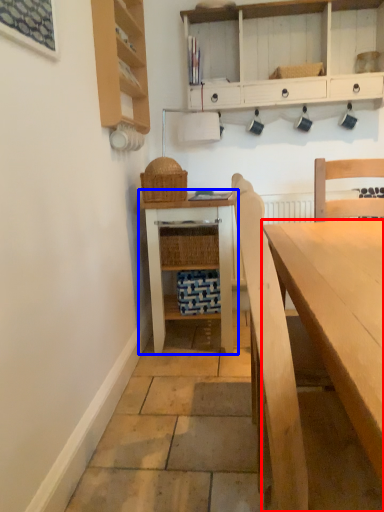
Question: Which point is closer to the camera, desk (highlighted by a red box) or table (highlighted by a blue box)?

Choices:
 (A) desk
 (B) table

Answer: (A)